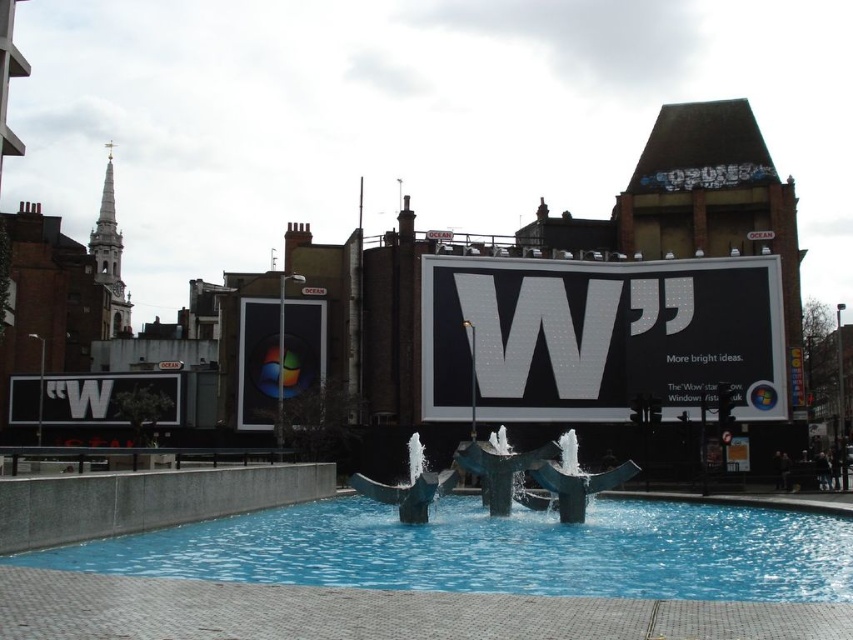
From the picture: You are standing in the urban area and want to take a photo of the blue glossy water at center and the matte glass window at center. Which object should you frame first in your camera viewfinder to ensure both are captured?

You should frame the matte glass window at center first because the blue glossy water at center is to the right of it, so positioning the window first ensures the water will be included to its right.

You are a photographer standing in the urban scene and want to capture both the blue glossy water at center and the white matte sign at lower left in a single frame. Based on their positions, which object should you adjust your camera to focus on first to ensure both are in the shot?

The blue glossy water at center is positioned on the right side of white matte sign at lower left. To capture both in a single frame, you should focus on the white matte sign at lower left first since it is on the left, allowing you to frame the shot to include both the left and right positioned objects.

You are designing a layout for a new app and need to decide where to place two elements. The first element is a blue glossy water at center, and the second is a white matte sign at lower left. Based on the image, which element should be placed first if you want to prioritize the wider element?

The blue glossy water at center should be placed first because it is wider than the white matte sign at lower left according to the description.